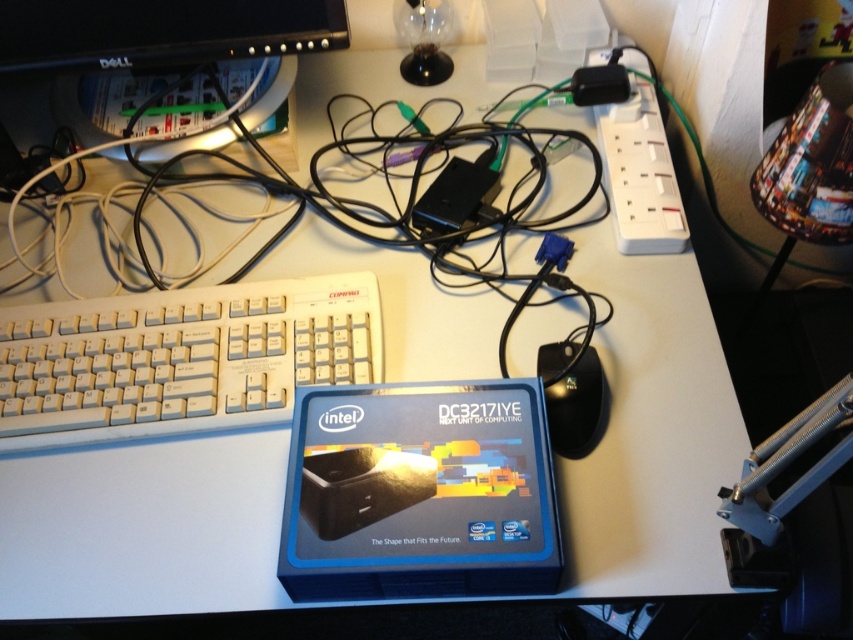
Does black plastic plug at upper right have a lesser height compared to black plastic mouse at lower right?

No.

From the picture: Who is positioned more to the right, black plastic plug at upper right or black plastic mouse at lower right?

From the viewer's perspective, black plastic plug at upper right appears more on the right side.

Does point (662, 180) lie in front of point (560, 346)?

That is False.

Locate an element on the screen. The image size is (853, 640). black plastic plug at upper right is located at coordinates (640, 173).

What do you see at coordinates (419, 492) in the screenshot? I see `blue matte intel dc3217iye at center` at bounding box center [419, 492].

Is blue matte intel dc3217iye at center above black plastic plug at upper right?

No.

Measure the distance between blue matte intel dc3217iye at center and camera.

blue matte intel dc3217iye at center and camera are 22.54 inches apart from each other.

Identify the location of blue matte intel dc3217iye at center. Image resolution: width=853 pixels, height=640 pixels. pyautogui.click(x=419, y=492).

Is white plastic keyboard at left below black plastic mouse at lower right?

No, white plastic keyboard at left is not below black plastic mouse at lower right.

Does point (148, 422) come closer to viewer compared to point (595, 406)?

No, (148, 422) is behind (595, 406).

Does point (311, 321) come behind point (570, 428)?

That is True.

At what (x,y) coordinates should I click in order to perform the action: click on white plastic keyboard at left. Please return your answer as a coordinate pair (x, y). The image size is (853, 640). Looking at the image, I should click on (180, 358).